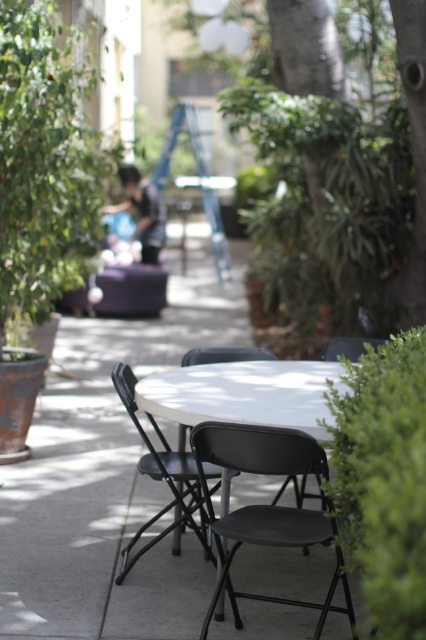
Question: Which of the following is the closest to the observer?

Choices:
 (A) black plastic chair at center
 (B) black plastic folding chair at center
 (C) green leafy tree at upper left
 (D) white matte table at center

Answer: (B)

Question: Can you confirm if green leafy tree at upper left is smaller than white matte table at center?

Choices:
 (A) no
 (B) yes

Answer: (A)

Question: Does green leafy tree at upper left have a lesser width compared to black plastic folding chair at center?

Choices:
 (A) no
 (B) yes

Answer: (A)

Question: Which object is positioned closest to the black plastic folding chair at center?

Choices:
 (A) green leafy tree at upper left
 (B) white matte table at center

Answer: (B)

Question: Which point is closer to the camera?

Choices:
 (A) (219, 554)
 (B) (204, 378)
 (C) (37, 10)
 (D) (169, 464)

Answer: (A)

Question: Can you confirm if black plastic folding chair at center is thinner than black plastic chair at center?

Choices:
 (A) no
 (B) yes

Answer: (A)